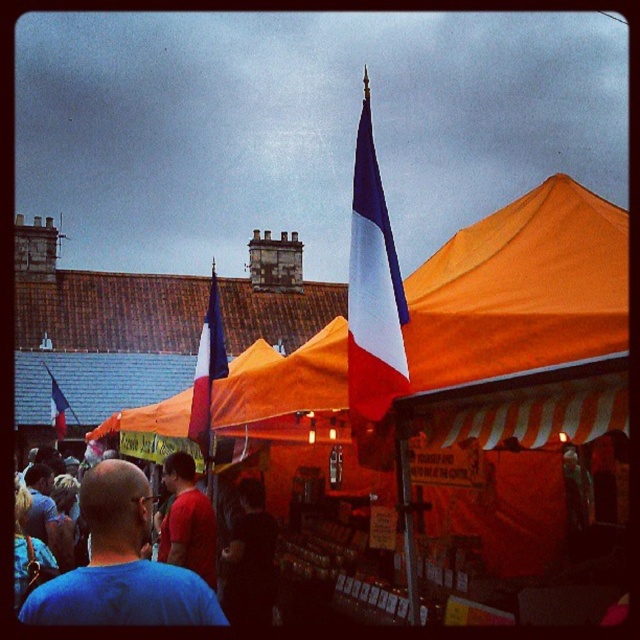
Question: Is dark fabric shirt at center smaller than red cotton shirt at center?

Choices:
 (A) yes
 (B) no

Answer: (A)

Question: Among these objects, which one is farthest from the camera?

Choices:
 (A) french flag at center
 (B) blue t-shirt at center
 (C) matte red flag at left

Answer: (C)

Question: In this image, where is french flag at center located relative to matte red flag at left?

Choices:
 (A) left
 (B) right

Answer: (B)

Question: Can you confirm if dark fabric shirt at center is positioned to the left of french flag at center?

Choices:
 (A) no
 (B) yes

Answer: (A)

Question: Which of these objects is positioned closest to the french flag at center?

Choices:
 (A) matte red flag at left
 (B) blue-white-red fabric flag at center

Answer: (A)

Question: Which point is farther from the camera taking this photo?

Choices:
 (A) (349, 348)
 (B) (188, 497)
 (C) (252, 522)

Answer: (B)